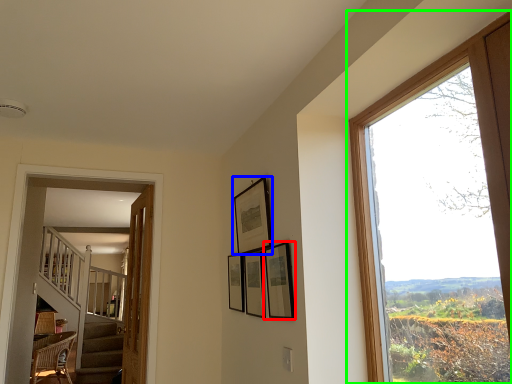
Question: Which is nearer to the picture frame (highlighted by a red box)? picture frame (highlighted by a blue box) or window (highlighted by a green box).

Choices:
 (A) picture frame
 (B) window

Answer: (A)